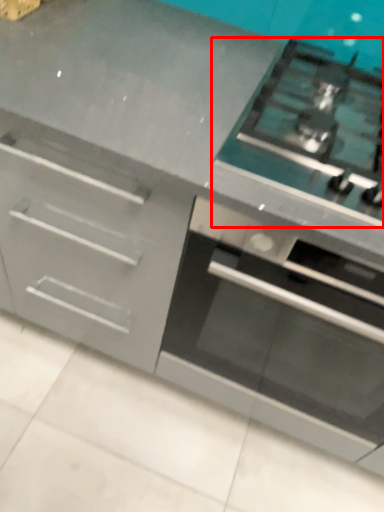
Question: From the image, what is the correct spatial relationship of gas stove (annotated by the red box) in relation to oven?

Choices:
 (A) right
 (B) left

Answer: (B)